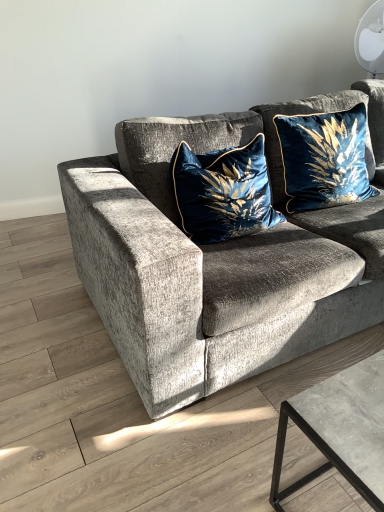
Describe the element at coordinates (218, 259) in the screenshot. I see `velvet gray couch at center` at that location.

Measure the distance between velvet gray couch at center and camera.

They are 3.65 feet apart.

At what (x,y) coordinates should I click in order to perform the action: click on velvet blue pillow at upper right, which ranks as the 2th pillow in left-to-right order. Please return your answer as a coordinate pair (x, y). Looking at the image, I should click on (324, 158).

Would you say velvet blue pillow at center, acting as the 2th pillow starting from the right, is a long distance from velvet blue pillow at upper right, which ranks as the 2th pillow in left-to-right order?

No, there isn't a large distance between velvet blue pillow at center, acting as the 2th pillow starting from the right, and velvet blue pillow at upper right, which ranks as the 2th pillow in left-to-right order.

Is velvet blue pillow at center, acting as the 2th pillow starting from the right, bigger than velvet blue pillow at upper right, which ranks as the 2th pillow in left-to-right order?

Yes, velvet blue pillow at center, acting as the 2th pillow starting from the right, is bigger than velvet blue pillow at upper right, which ranks as the 2th pillow in left-to-right order.

From the image's perspective, which is below, velvet blue pillow at center, acting as the 1th pillow starting from the left, or velvet blue pillow at upper right, which ranks as the 2th pillow in left-to-right order?

velvet blue pillow at center, acting as the 1th pillow starting from the left, appears lower in the image.

How different are the orientations of velvet blue pillow at center, acting as the 2th pillow starting from the right, and velvet blue pillow at upper right, which ranks as the 2th pillow in left-to-right order, in degrees?

They differ by 0.095 degrees in their facing directions.

Is velvet blue pillow at center, acting as the 1th pillow starting from the left, bigger or smaller than velvet gray couch at center?

Considering their sizes, velvet blue pillow at center, acting as the 1th pillow starting from the left, takes up less space than velvet gray couch at center.

What are the coordinates of `studio couch in front of the velvet blue pillow at center, acting as the 1th pillow starting from the left` in the screenshot? It's located at [218, 259].

Looking at this image, is velvet blue pillow at center, acting as the 2th pillow starting from the right, positioned before velvet gray couch at center?

That is False.

Is velvet blue pillow at center, acting as the 2th pillow starting from the right, oriented towards velvet gray couch at center?

Yes.

Are velvet blue pillow at upper right, the first pillow from the right, and velvet blue pillow at center, acting as the 1th pillow starting from the left, far apart?

No, velvet blue pillow at upper right, the first pillow from the right, is not far from velvet blue pillow at center, acting as the 1th pillow starting from the left.

From a real-world perspective, is velvet blue pillow at upper right, the first pillow from the right, physically located above or below velvet blue pillow at center, acting as the 2th pillow starting from the right?

From a real-world perspective, velvet blue pillow at upper right, the first pillow from the right, is physically above velvet blue pillow at center, acting as the 2th pillow starting from the right.

Which is more to the left, velvet blue pillow at upper right, the first pillow from the right, or velvet blue pillow at center, acting as the 2th pillow starting from the right?

velvet blue pillow at center, acting as the 2th pillow starting from the right.

Is velvet blue pillow at upper right, the first pillow from the right, spatially inside velvet blue pillow at center, acting as the 1th pillow starting from the left, or outside of it?

velvet blue pillow at upper right, the first pillow from the right, is not enclosed by velvet blue pillow at center, acting as the 1th pillow starting from the left.

From a real-world perspective, relative to velvet blue pillow at upper right, which ranks as the 2th pillow in left-to-right order, is velvet gray couch at center vertically above or below?

Clearly, from a real-world perspective, velvet gray couch at center is below velvet blue pillow at upper right, which ranks as the 2th pillow in left-to-right order.

Where is `studio couch located in front of the velvet blue pillow at upper right, the first pillow from the right`? The height and width of the screenshot is (512, 384). studio couch located in front of the velvet blue pillow at upper right, the first pillow from the right is located at coordinates (218, 259).

Is velvet gray couch at center next to velvet blue pillow at upper right, the first pillow from the right, and touching it?

velvet gray couch at center is not next to velvet blue pillow at upper right, the first pillow from the right, and they're not touching.

Is velvet gray couch at center further to camera compared to velvet blue pillow at upper right, which ranks as the 2th pillow in left-to-right order?

No, the depth of velvet gray couch at center is less than that of velvet blue pillow at upper right, which ranks as the 2th pillow in left-to-right order.

How different are the orientations of velvet blue pillow at upper right, the first pillow from the right, and velvet gray couch at center in degrees?

The angle between the facing direction of velvet blue pillow at upper right, the first pillow from the right, and the facing direction of velvet gray couch at center is 7.87 degrees.

Identify the location of studio couch located underneath the velvet blue pillow at upper right, the first pillow from the right (from a real-world perspective). (218, 259).

Does velvet blue pillow at upper right, the first pillow from the right, have a greater width compared to velvet gray couch at center?

Incorrect, the width of velvet blue pillow at upper right, the first pillow from the right, does not surpass that of velvet gray couch at center.

Which object is positioned more to the right, velvet blue pillow at upper right, the first pillow from the right, or velvet gray couch at center?

velvet gray couch at center.

Does velvet gray couch at center have a smaller size compared to velvet blue pillow at center, acting as the 2th pillow starting from the right?

Actually, velvet gray couch at center might be larger than velvet blue pillow at center, acting as the 2th pillow starting from the right.

Considering the points (362, 206) and (257, 201), which point is in front, point (362, 206) or point (257, 201)?

The point (257, 201) is more forward.

Looking at this image, in terms of height, does velvet gray couch at center look taller or shorter compared to velvet blue pillow at center, acting as the 2th pillow starting from the right?

In the image, velvet gray couch at center appears to be taller than velvet blue pillow at center, acting as the 2th pillow starting from the right.

Find the location of a particular element. The width and height of the screenshot is (384, 512). pillow on the left of the velvet blue pillow at upper right, which ranks as the 2th pillow in left-to-right order is located at coordinates click(223, 192).

Where is `studio couch in front of the velvet blue pillow at center, acting as the 2th pillow starting from the right`? studio couch in front of the velvet blue pillow at center, acting as the 2th pillow starting from the right is located at coordinates (218, 259).

Looking at the image, which one is located further to velvet blue pillow at center, acting as the 2th pillow starting from the right, velvet blue pillow at upper right, the first pillow from the right, or velvet gray couch at center?

Based on the image, velvet blue pillow at upper right, the first pillow from the right, appears to be further to velvet blue pillow at center, acting as the 2th pillow starting from the right.

From the image, which object appears to be farther from velvet gray couch at center, velvet blue pillow at upper right, which ranks as the 2th pillow in left-to-right order, or velvet blue pillow at center, acting as the 1th pillow starting from the left?

velvet blue pillow at upper right, which ranks as the 2th pillow in left-to-right order, is further to velvet gray couch at center.

Which object lies further to the anchor point velvet blue pillow at upper right, the first pillow from the right, velvet gray couch at center or velvet blue pillow at center, acting as the 2th pillow starting from the right?

velvet gray couch at center.

Which object lies nearer to the anchor point velvet blue pillow at center, acting as the 2th pillow starting from the right, velvet gray couch at center or velvet blue pillow at upper right, which ranks as the 2th pillow in left-to-right order?

Among the two, velvet gray couch at center is located nearer to velvet blue pillow at center, acting as the 2th pillow starting from the right.

Looking at the image, which one is located further to velvet gray couch at center, velvet blue pillow at center, acting as the 2th pillow starting from the right, or velvet blue pillow at upper right, the first pillow from the right?

The object further to velvet gray couch at center is velvet blue pillow at upper right, the first pillow from the right.

Based on the photo, from the image, which object appears to be nearer to velvet blue pillow at upper right, the first pillow from the right, velvet blue pillow at center, acting as the 1th pillow starting from the left, or velvet gray couch at center?

velvet blue pillow at center, acting as the 1th pillow starting from the left, is closer to velvet blue pillow at upper right, the first pillow from the right.

The image size is (384, 512). What are the coordinates of `pillow located between velvet gray couch at center and velvet blue pillow at upper right, the first pillow from the right, in the depth direction` in the screenshot? It's located at (223, 192).